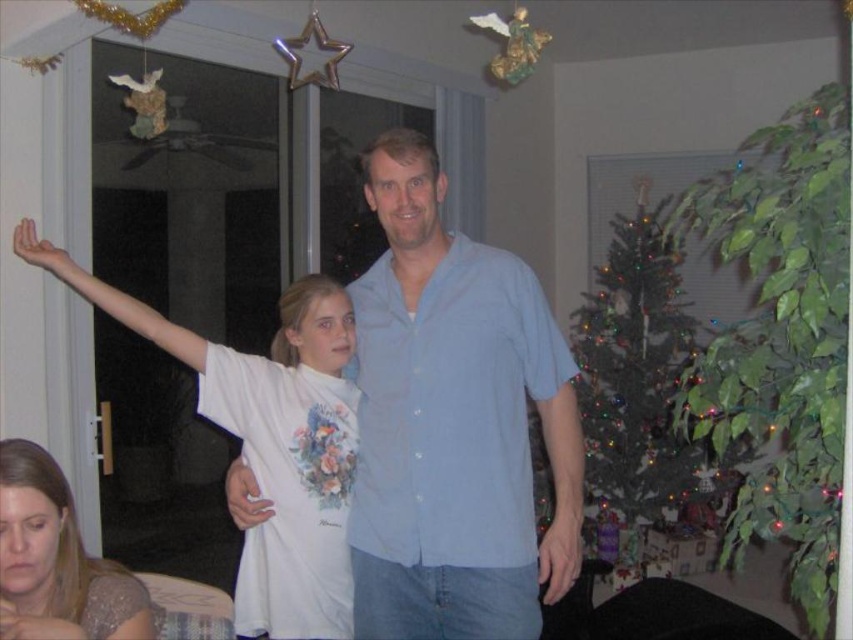
Looking at this image, who is positioned more to the left, white cotton shirt at center or green matte christmas tree at right?

Positioned to the left is white cotton shirt at center.

Is white cotton shirt at center shorter than green matte christmas tree at right?

Yes.

You are a GUI agent. You are given a task and a screenshot of the screen. Output one action in this format:
    pyautogui.click(x=<x>, y=<y>)
    Task: Click on the white cotton shirt at center
    This screenshot has width=853, height=640.
    Given the screenshot: What is the action you would take?
    pyautogui.click(x=268, y=436)

Find the location of a particular element. This screenshot has height=640, width=853. white cotton shirt at center is located at coordinates (268, 436).

Does point (409, 506) come in front of point (631, 536)?

Yes.

Describe the element at coordinates (454, 422) in the screenshot. This screenshot has height=640, width=853. I see `light blue button-down shirt at center` at that location.

This screenshot has height=640, width=853. What are the coordinates of `light blue button-down shirt at center` in the screenshot? It's located at (454, 422).

Which is in front, point (416, 269) or point (316, 440)?

Point (416, 269)

Between point (490, 497) and point (338, 518), which one is positioned behind?

The point (338, 518) is behind.

Does point (465, 376) come closer to viewer compared to point (239, 365)?

Yes.

Identify the location of light blue button-down shirt at center. The width and height of the screenshot is (853, 640). (454, 422).